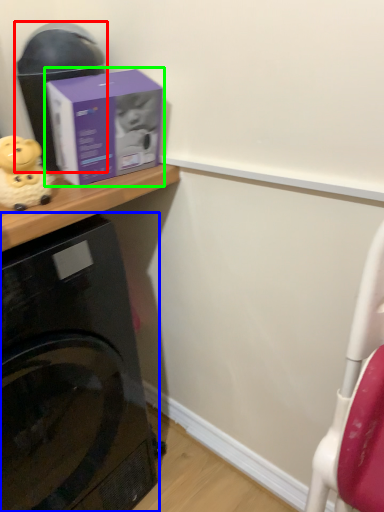
Question: Which object is the closest to the appliance (highlighted by a red box)? Choose among these: home appliance (highlighted by a blue box) or box (highlighted by a green box).

Choices:
 (A) home appliance
 (B) box

Answer: (B)